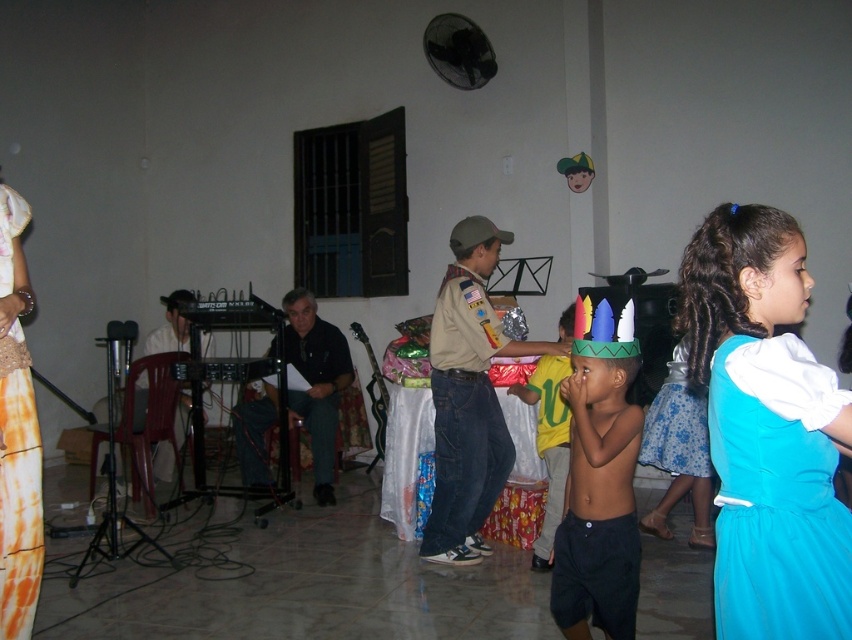
You are a photographer standing in the room. You want to take a photo that includes both the turquoise satin dress at right and the shiny plastic crown at center. What is the minimum distance you need to move backward to ensure both objects are in frame?

The minimum distance you need to move backward is 3.50 feet to ensure both the turquoise satin dress at right and the shiny plastic crown at center are in frame.